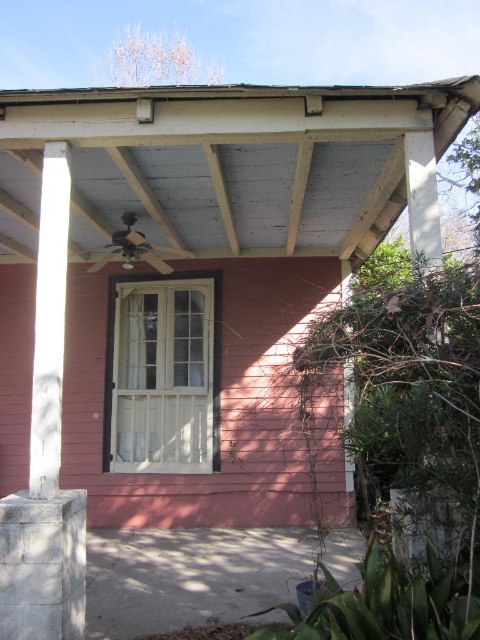
Between wooden ceiling at center and white painted wood beam at left, which one is positioned lower?

white painted wood beam at left

Between wooden ceiling at center and white painted wood beam at left, which one appears on the right side from the viewer's perspective?

wooden ceiling at center

Is point (80, 106) behind point (38, 342)?

Yes, it is behind point (38, 342).

This screenshot has width=480, height=640. Identify the location of wooden ceiling at center. (197, 276).